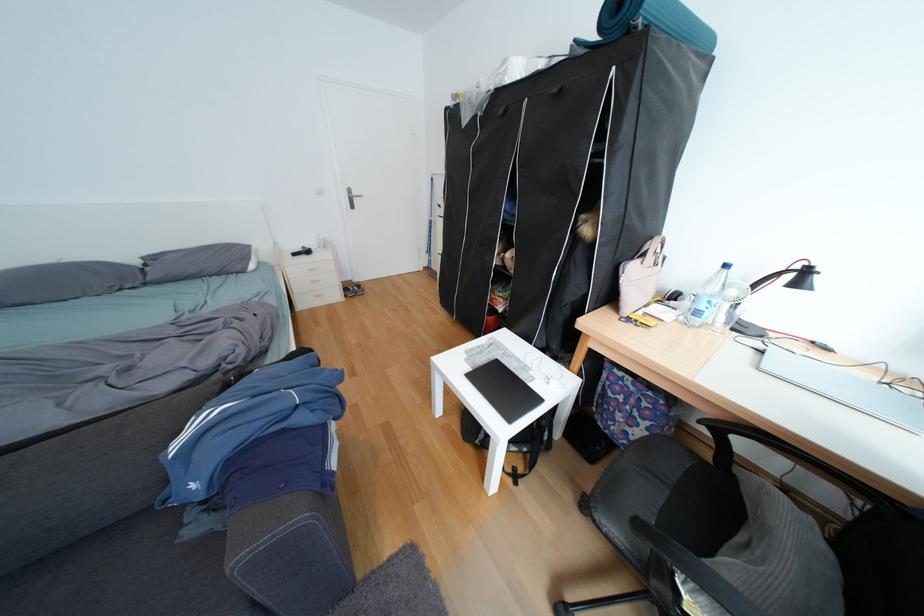
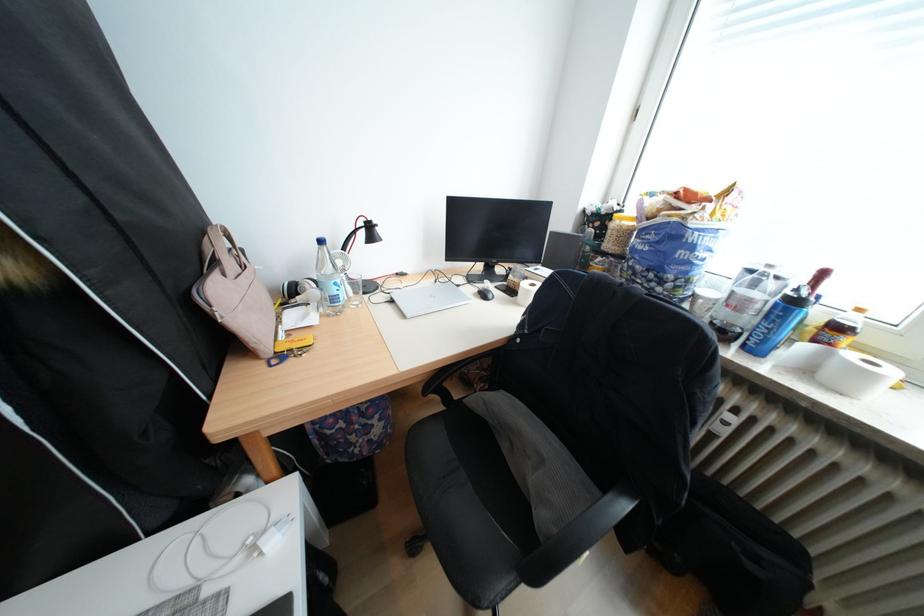
In the second image, find the point that corresponds to point (691, 313) in the first image.

(325, 306)